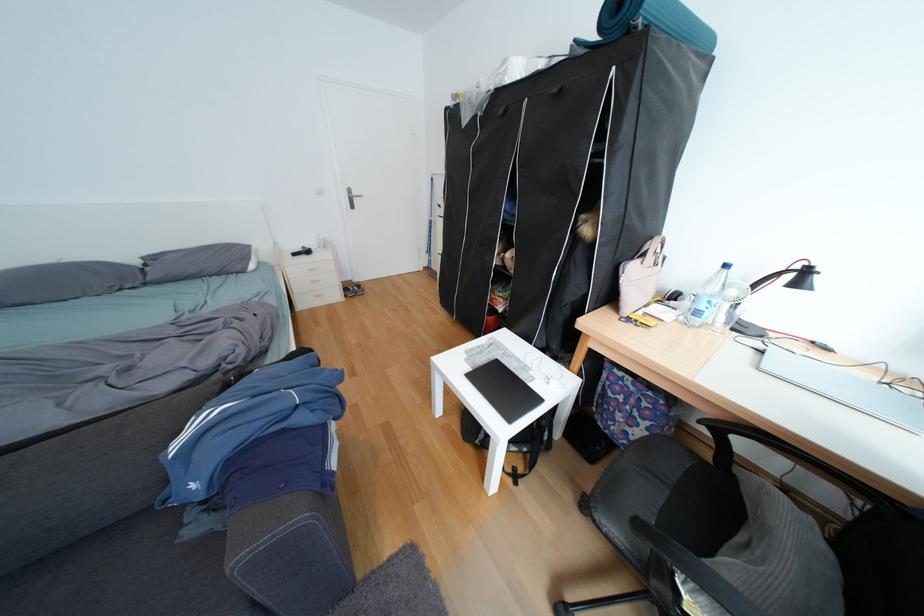
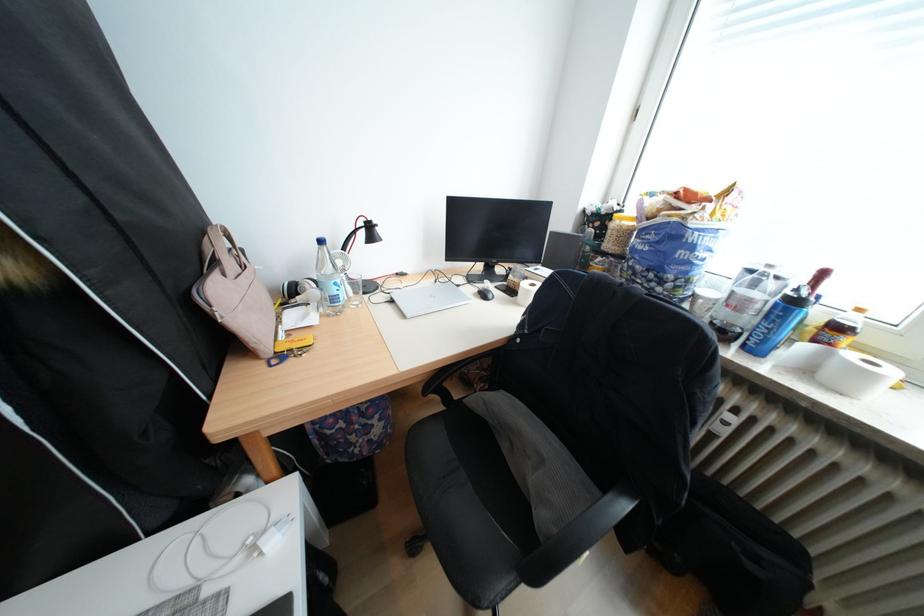
In the second image, find the point that corresponds to point (691, 313) in the first image.

(325, 306)